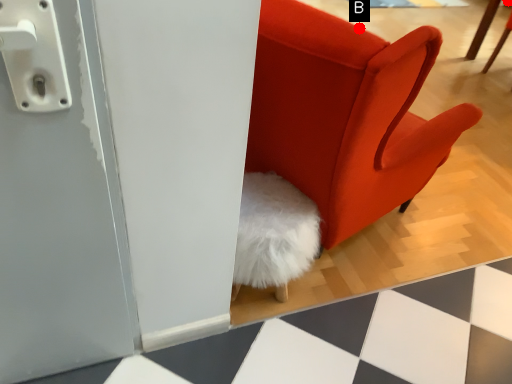
Question: Two points are circled on the image, labeled by A and B beside each circle. Which point is farther to the camera?

Choices:
 (A) A is further
 (B) B is further

Answer: (A)